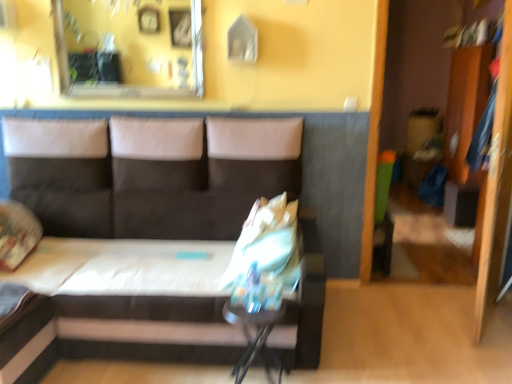
Question: Would you say wooden dresser at right is inside or outside metallic glossy table at lower center?

Choices:
 (A) inside
 (B) outside

Answer: (B)

Question: Is wooden dresser at right wider or thinner than metallic glossy table at lower center?

Choices:
 (A) thin
 (B) wide

Answer: (A)

Question: Estimate the real-world distances between objects in this image. Which object is closer to the dark gray fabric couch at center?

Choices:
 (A) wooden dresser at right
 (B) metallic glossy table at lower center
 (C) clear glass mirror at upper center

Answer: (B)

Question: Which object is the farthest from the wooden dresser at right?

Choices:
 (A) dark gray fabric couch at center
 (B) clear glass mirror at upper center
 (C) metallic glossy table at lower center

Answer: (C)